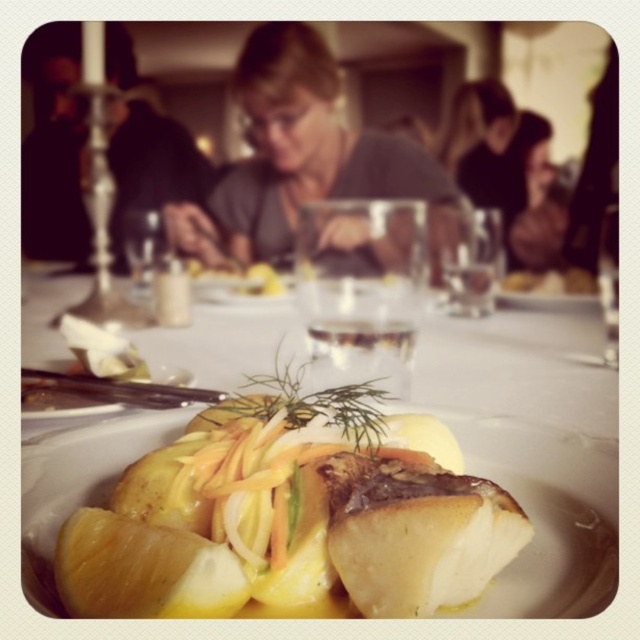
Question: Which point is farther from the camera taking this photo?

Choices:
 (A) (266, 240)
 (B) (486, 104)

Answer: (A)

Question: Among these points, which one is nearest to the camera?

Choices:
 (A) (243, 360)
 (B) (285, 77)
 (C) (458, 99)
 (D) (605, 486)

Answer: (D)

Question: Among these objects, which one is farthest from the camera?

Choices:
 (A) golden glazed fish at center
 (B) white porcelain plate at center
 (C) matte gray sweater at upper center
 (D) gray matte shirt at center

Answer: (D)

Question: Does gray matte shirt at center appear over matte gray sweater at upper center?

Choices:
 (A) no
 (B) yes

Answer: (B)

Question: Does white porcelain plate at center appear under golden glazed fish at center?

Choices:
 (A) no
 (B) yes

Answer: (A)

Question: Does golden glazed fish at center appear over matte gray sweater at upper center?

Choices:
 (A) yes
 (B) no

Answer: (B)